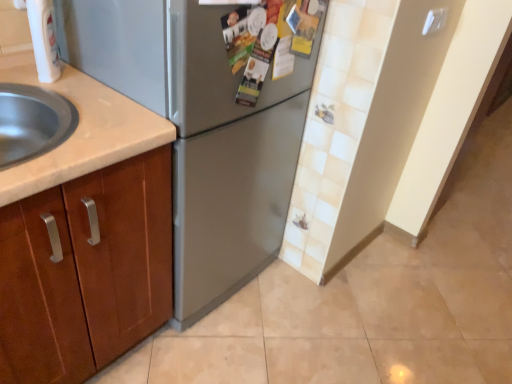
Question: Is satin silver refrigerator at center spatially inside white plastic faucet at upper left, or outside of it?

Choices:
 (A) inside
 (B) outside

Answer: (B)

Question: Is satin silver refrigerator at center to the left or to the right of white plastic faucet at upper left in the image?

Choices:
 (A) right
 (B) left

Answer: (A)

Question: From the image's perspective, relative to white plastic faucet at upper left, is satin silver refrigerator at center above or below?

Choices:
 (A) below
 (B) above

Answer: (A)

Question: From the image's perspective, is white plastic faucet at upper left above or below satin silver refrigerator at center?

Choices:
 (A) above
 (B) below

Answer: (A)

Question: Based on their sizes in the image, would you say white plastic faucet at upper left is bigger or smaller than satin silver refrigerator at center?

Choices:
 (A) big
 (B) small

Answer: (B)

Question: Is point (33, 21) closer or farther from the camera than point (205, 220)?

Choices:
 (A) closer
 (B) farther

Answer: (A)

Question: Relative to satin silver refrigerator at center, is white plastic faucet at upper left in front or behind?

Choices:
 (A) front
 (B) behind

Answer: (B)